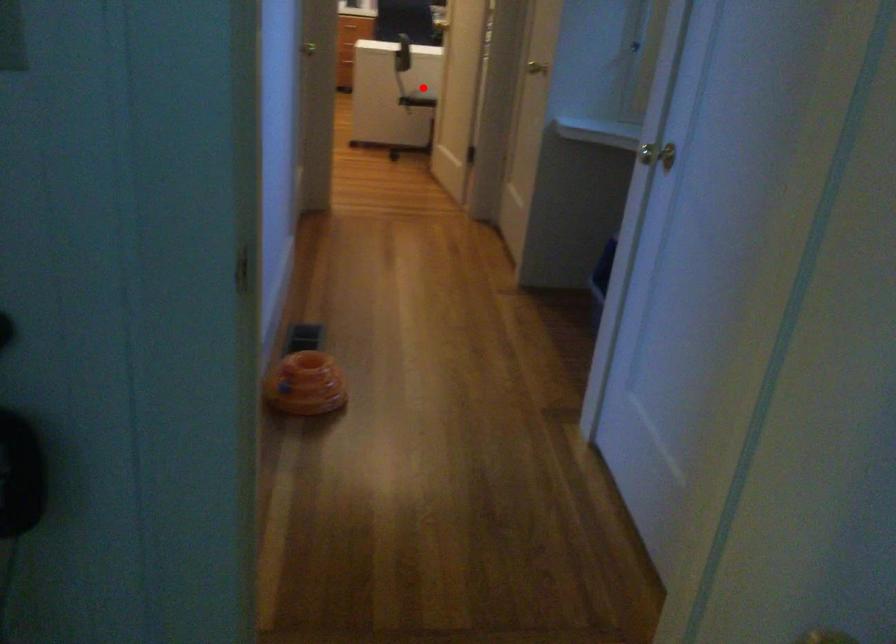
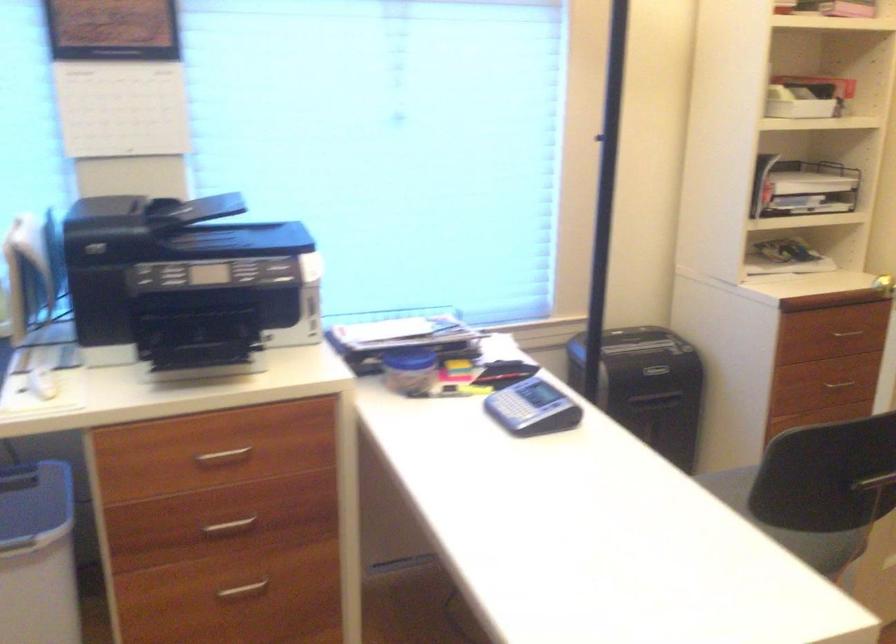
Question: I am providing you with two images of the same scene from different viewpoints. In image1, a red point is highlighted. Considering the same 3D point in image2, which of the following is correct?

Choices:
 (A) It is closer
 (B) It is farther

Answer: (A)